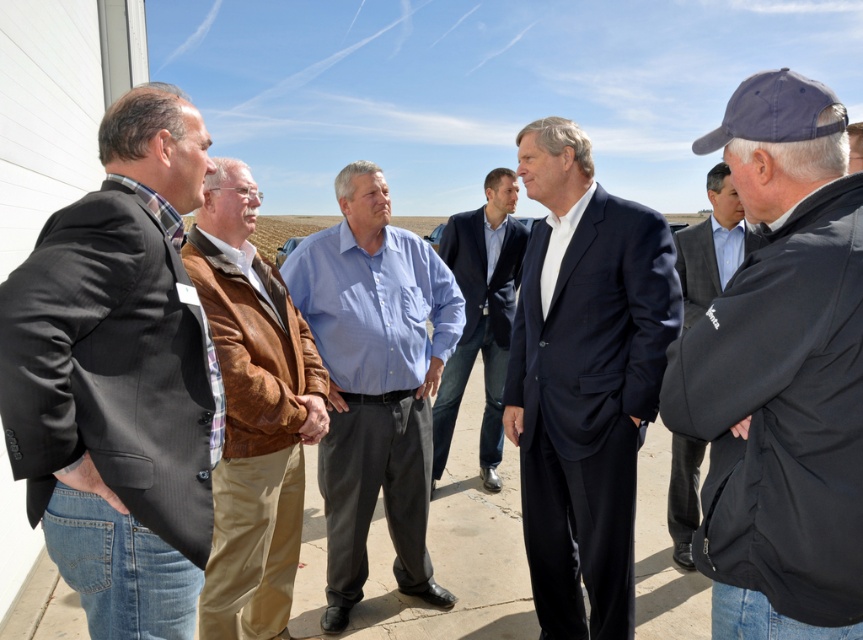
You are a photographer trying to capture a clear photo of the dark blue cap at center and the dark gray jacket at right. Since you want both objects to be visible in the frame, which object should you focus on first to ensure proper depth of field?

The dark blue cap at center should be focused on first because it is thinner than the dark gray jacket at right, so focusing on the closer or smaller object first can help ensure both are in focus.

You are a photographer trying to capture a photo of the group. You want to ensure that the dark gray pinstripe suit at left and the blue shirt at center are both in the frame. Based on their positions, which one should you focus on first to ensure both are included?

The dark gray pinstripe suit at left is positioned on the left side of blue shirt at center. To include both in the frame, focus on the blue shirt at center first, as it is centrally located and the dark gray pinstripe suit at left is to its left, making it easier to frame both by starting at the center.

You are a photographer trying to capture a group photo of the dark gray pinstripe suit at left and the blue cotton shirt at center. The camera can only focus on objects within a 1.5 meter width. Will both subjects fit within the camera frame?

The dark gray pinstripe suit at left is narrower than the blue cotton shirt at center. Since the camera can focus on objects within 1.5 meters, and the blue cotton shirt at center is wider, it might exceed the frame. However, the exact width of each isn